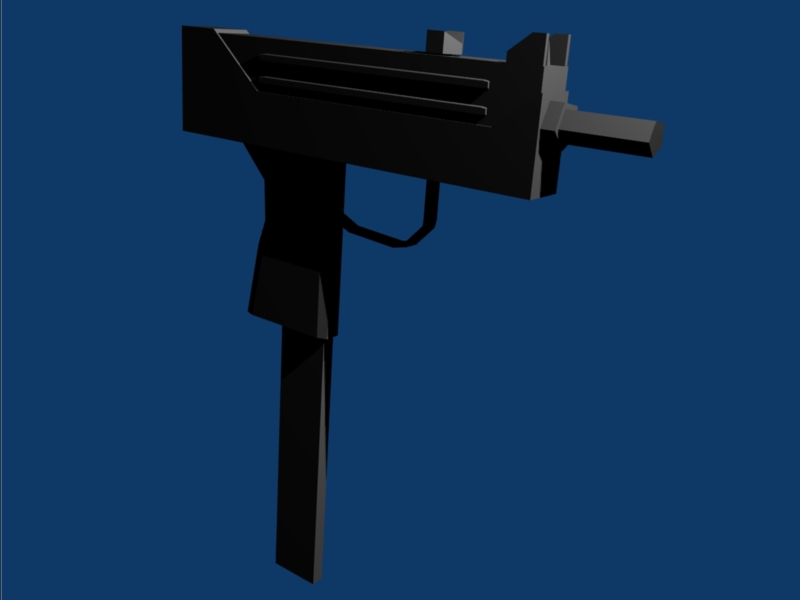
The height and width of the screenshot is (600, 800). Identify the location of magazine. (301, 439).